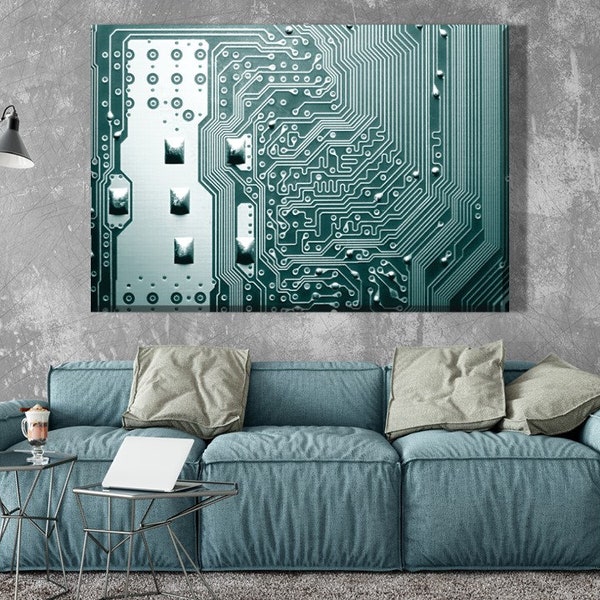
This screenshot has width=600, height=600. I want to click on laptop, so click(x=140, y=463).